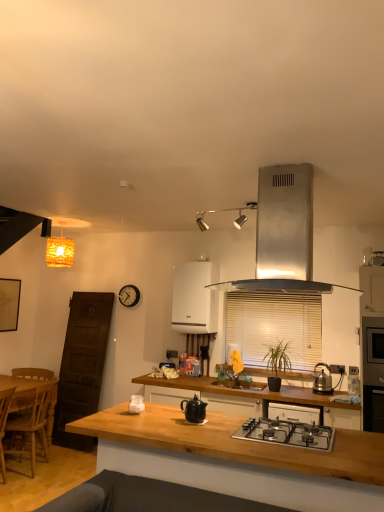
Question: From a real-world perspective, relative to black stainless steel oven at right, is white glossy jar at center, which ranks as the 5th kitchen appliance in right-to-left order, vertically above or below?

Choices:
 (A) above
 (B) below

Answer: (B)

Question: In the image, is white glossy jar at center, the first kitchen appliance in the left-to-right sequence, on the left side or the right side of black stainless steel oven at right?

Choices:
 (A) right
 (B) left

Answer: (B)

Question: Which object is positioned farthest from the black stainless steel oven at right?

Choices:
 (A) shiny metallic kettle at center, which ranks as the 4th kitchen appliance in front-to-back order
 (B) satin silver range hood at upper center, the 5th kitchen appliance from the back
 (C) wooden at center
 (D) white glossy wall oven at center, acting as the 4th kitchen appliance starting from the bottom
 (E) wooden countertop at center

Answer: (D)

Question: Which of these objects is positioned farthest from the white blinds at center?

Choices:
 (A) black ceramic teapot at center, which ranks as the second kitchen appliance in front-to-back order
 (B) wooden countertop at center
 (C) white glossy jar at center, arranged as the 3th kitchen appliance when viewed from the back
 (D) satin silver range hood at upper center, acting as the 1th kitchen appliance starting from the front
 (E) stainless steel gas stove at center

Answer: (D)